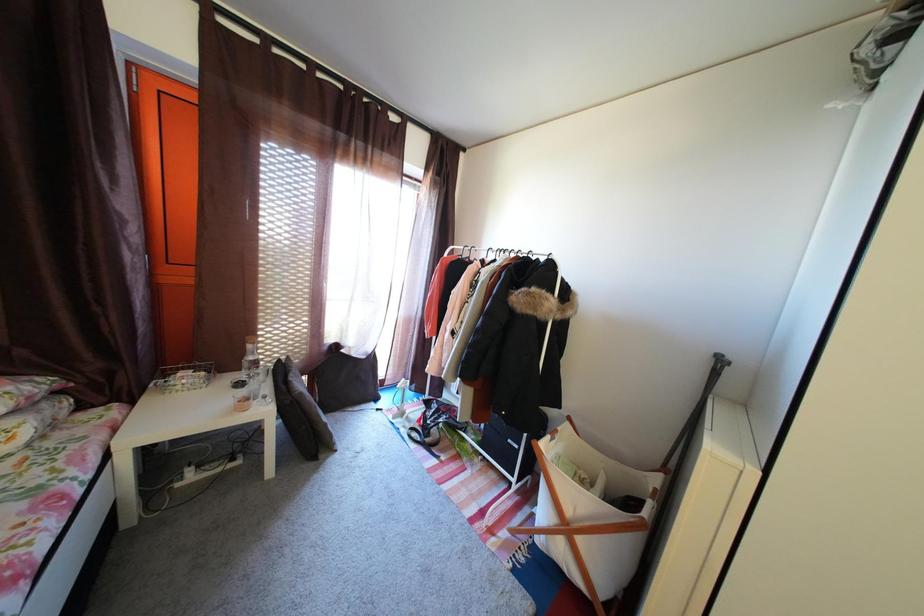
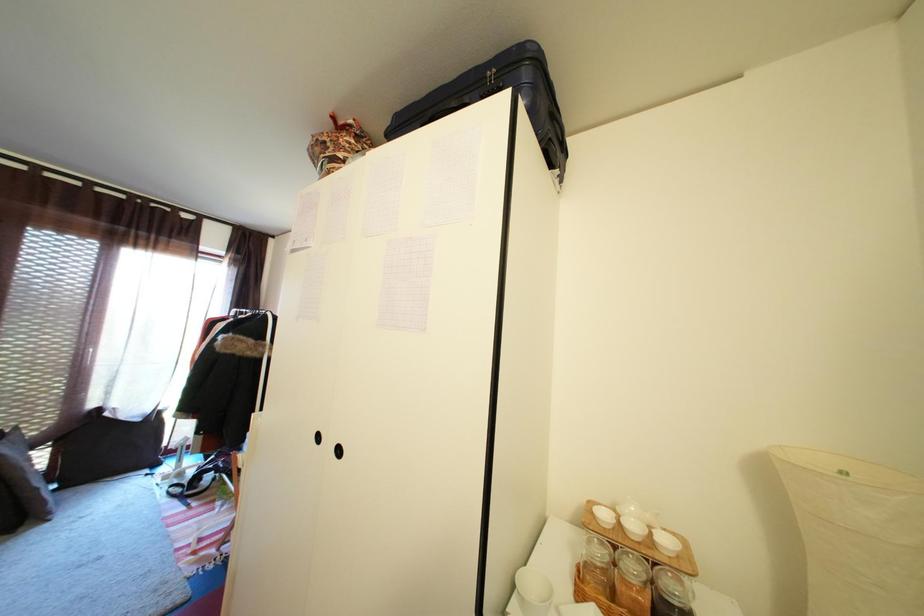
In a continuous first-person perspective shot, in which direction is the camera moving?

The movement direction of the cameraman is right, backward.